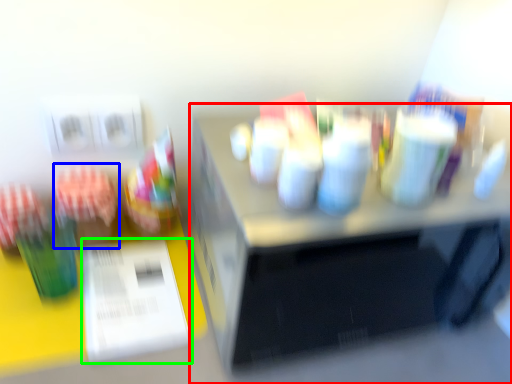
Question: Which object is positioned closest to desk (highlighted by a red box)? Select from stationery (highlighted by a blue box) and paper (highlighted by a green box).

Choices:
 (A) stationery
 (B) paper

Answer: (B)